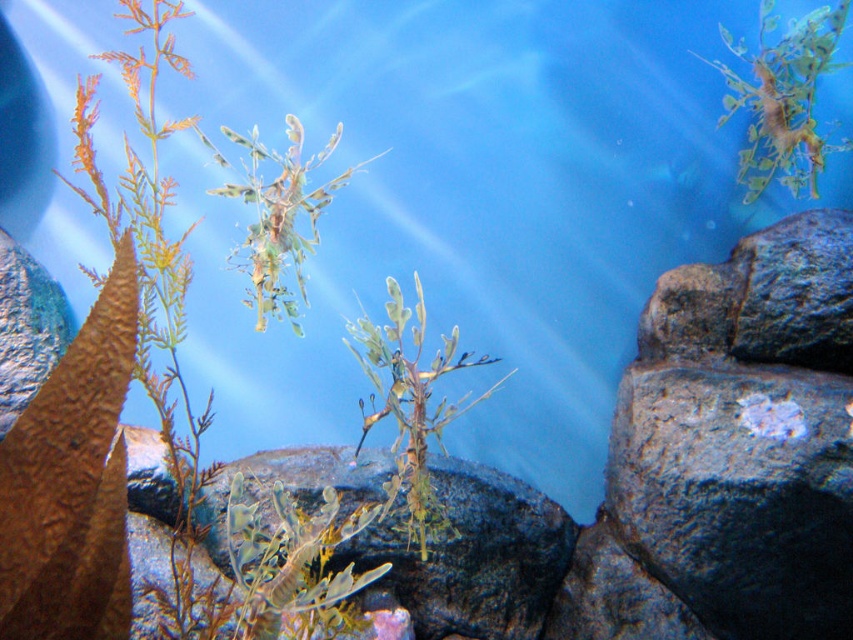
You are an underwater explorer observing the scene. You see the green translucent plant at center. Where is it positioned relative to the tall brownish plant with thin elongated leaves on the left?

The green translucent plant at center is located at point (x=410, y=404), which is to the right of the tall brownish plant with thin elongated leaves on the left.

You are an underwater explorer who needs to navigate between the green leafy plant at upper right and the green leafy plant at center. Which plant should you avoid if you want to pass through the taller one?

You should avoid the green leafy plant at upper right because it is shorter than the green leafy plant at center. To pass through the taller one, choose the green leafy plant at center.

You are a scuba diver with a 1.8 meter long measuring tape. You want to measure the distance between yourself and the green leafy plant at upper right. Can you reach it with your tape?

The green leafy plant at upper right and camera are 1.92 meters apart. Since your tape is 1.8 meters long, it is 0.12 meters shorter than the required distance, so you cannot reach it with your tape.